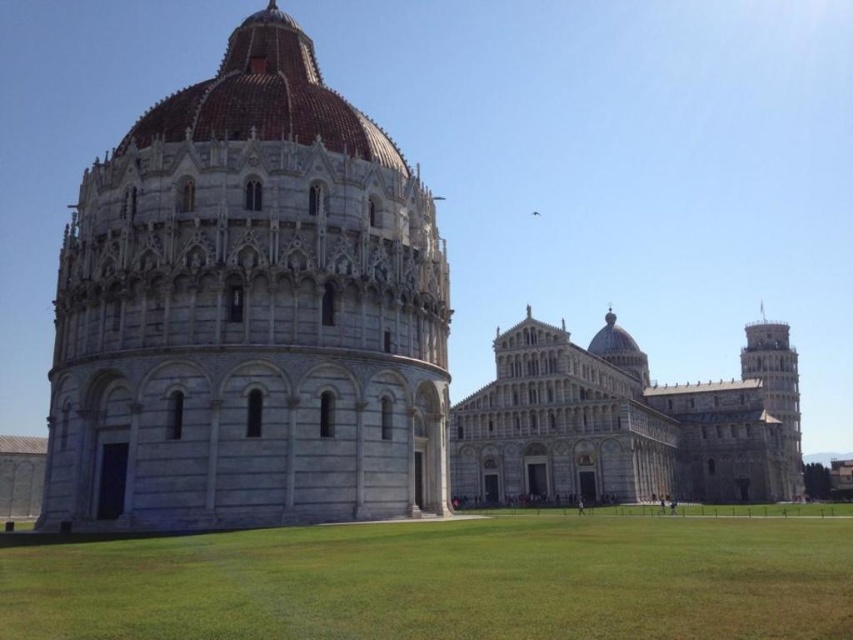
Based on the photo, can you confirm if white marble tower at center is positioned to the left of green grass at lower center?

Correct, you'll find white marble tower at center to the left of green grass at lower center.

Who is more forward, (200,445) or (148,624)?

Point (148,624) is in front.

Is point (61, 298) positioned before point (160, 557)?

No, (61, 298) is further to viewer.

This screenshot has width=853, height=640. I want to click on white marble tower at center, so click(x=248, y=312).

Is the position of white marble tower at center more distant than that of brown tiled dome at upper center?

No, white marble tower at center is closer to the viewer.

Who is positioned more to the right, white marble tower at center or brown tiled dome at upper center?

brown tiled dome at upper center

Which is in front, point (119, 144) or point (323, 100)?

Point (323, 100) is more forward.

This screenshot has width=853, height=640. Find the location of `white marble tower at center`. white marble tower at center is located at coordinates [248, 312].

Can you confirm if green grass at lower center is smaller than gray stone leaning tower at right?

Indeed, green grass at lower center has a smaller size compared to gray stone leaning tower at right.

Between green grass at lower center and gray stone leaning tower at right, which one appears on the right side from the viewer's perspective?

From the viewer's perspective, gray stone leaning tower at right appears more on the right side.

Describe the element at coordinates (445, 580) in the screenshot. I see `green grass at lower center` at that location.

The height and width of the screenshot is (640, 853). I want to click on green grass at lower center, so click(445, 580).